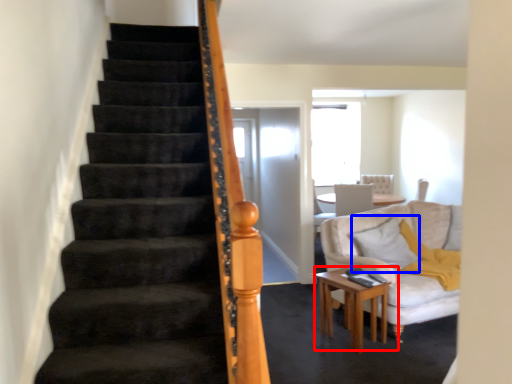
Question: Among these objects, which one is farthest to the camera, table (highlighted by a red box) or pillow (highlighted by a blue box)?

Choices:
 (A) table
 (B) pillow

Answer: (B)